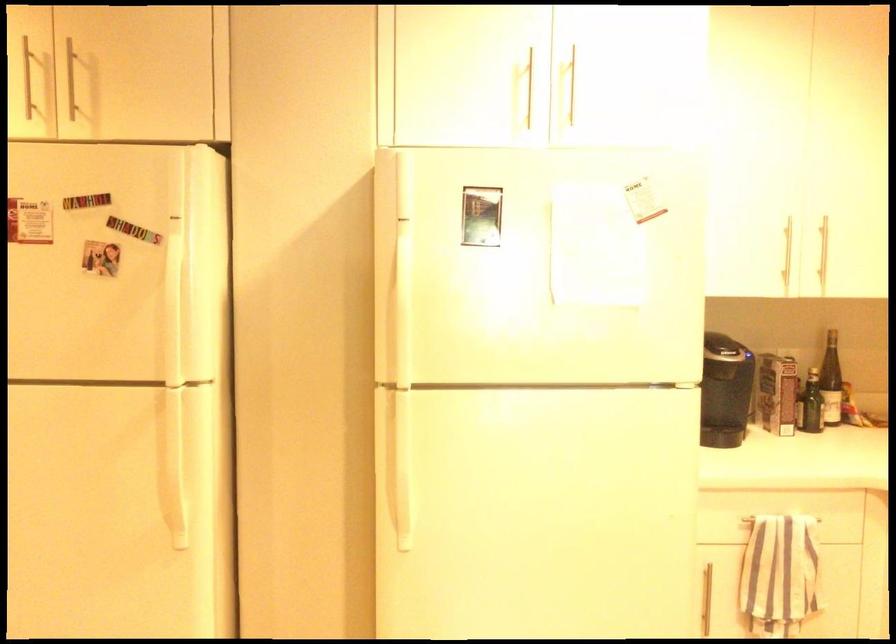
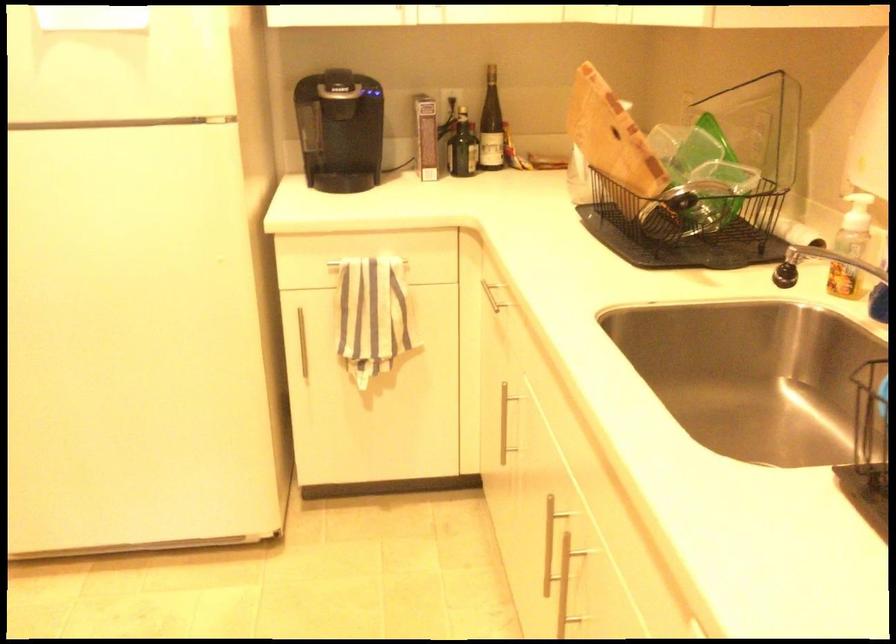
Question: The first image is from the beginning of the video and the second image is from the end. How did the camera likely rotate when shooting the video?

Choices:
 (A) Left
 (B) Right
 (C) Up
 (D) Down

Answer: (D)